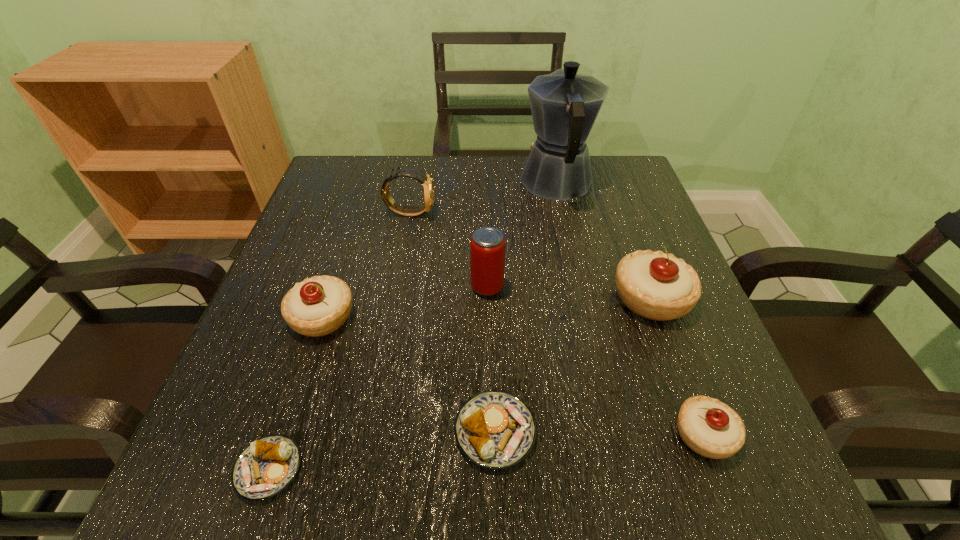
Where is `the tallest object`? the tallest object is located at coordinates (564, 105).

Where is `beer can`? beer can is located at coordinates (487, 247).

I want to click on watch, so click(428, 188).

This screenshot has height=540, width=960. What are the coordinates of `gold watch` in the screenshot? It's located at (428, 188).

Where is `the biggest beige pastry`? Image resolution: width=960 pixels, height=540 pixels. the biggest beige pastry is located at coordinates (654, 285).

Find the location of a particular element. The image size is (960, 540). the fifth tallest object is located at coordinates (317, 306).

The image size is (960, 540). I want to click on the second smallest beige pastry, so [x=317, y=306].

Identify the location of the smallest beige pastry. This screenshot has height=540, width=960. [709, 427].

Where is `the third shortest pastry`? This screenshot has width=960, height=540. the third shortest pastry is located at coordinates (709, 427).

Find the location of a particular element. The height and width of the screenshot is (540, 960). the fourth tallest pastry is located at coordinates (494, 429).